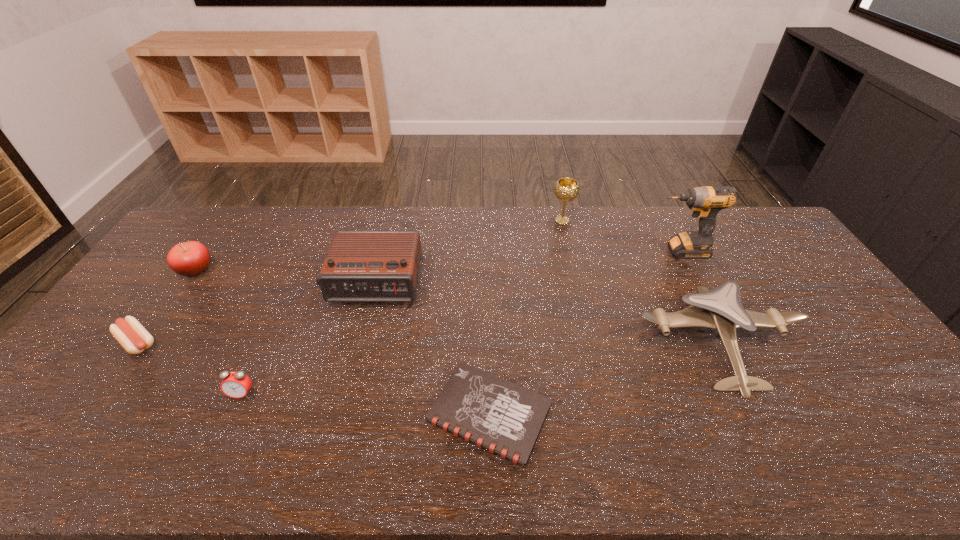
Find the location of a particular element. the fifth object from left to right is located at coordinates (502, 417).

Where is `vacant region located 0.200m with the drill bit of the tallest object facing forward`? This screenshot has width=960, height=540. vacant region located 0.200m with the drill bit of the tallest object facing forward is located at coordinates (592, 251).

Identify the location of vacant space located with the drill bit of the tallest object facing forward. (535, 251).

This screenshot has width=960, height=540. What are the coordinates of `free space located 0.180m with the drill bit of the tallest object facing forward` in the screenshot? It's located at (598, 251).

Where is `vacant space situated on the right of the chalice`? The width and height of the screenshot is (960, 540). vacant space situated on the right of the chalice is located at coordinates (677, 221).

Find the location of a particular element. free space located 0.180m on the front panel of the radio receiver is located at coordinates (355, 357).

The height and width of the screenshot is (540, 960). In order to click on vacant space located 0.220m on the right of the apple in this screenshot , I will do `click(280, 271)`.

Where is `blank area located 0.140m on the front-facing side of the drone`? The height and width of the screenshot is (540, 960). blank area located 0.140m on the front-facing side of the drone is located at coordinates (774, 453).

At what (x,y) coordinates should I click in order to perform the action: click on vacant region located 0.090m on the front-facing side of the sixth tallest object. Please return your answer as a coordinate pair (x, y). Looking at the image, I should click on (224, 435).

The image size is (960, 540). In order to click on vacant area situated on the right of the sausage in this screenshot , I will do `click(180, 342)`.